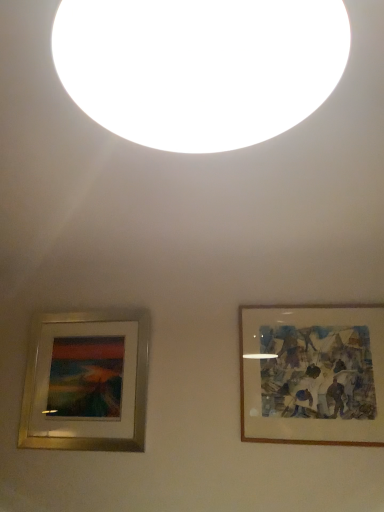
Question: From the image's perspective, is gold metallic picture frame at lower left, the second picture frame positioned from the right, located above or below wooden frame at right, which appears as the 2th picture frame when viewed from the left?

Choices:
 (A) above
 (B) below

Answer: (B)

Question: Is gold metallic picture frame at lower left, the second picture frame positioned from the right, to the left or to the right of wooden frame at right, the first picture frame in the right-to-left sequence, in the image?

Choices:
 (A) right
 (B) left

Answer: (B)

Question: Which of these objects is positioned farthest from the white matte light at upper center?

Choices:
 (A) gold metallic picture frame at lower left, which appears as the 1th picture frame when viewed from the left
 (B) wooden frame at right, the first picture frame in the right-to-left sequence

Answer: (A)

Question: Which object is positioned farthest from the white matte light at upper center?

Choices:
 (A) wooden frame at right, which appears as the 2th picture frame when viewed from the left
 (B) gold metallic picture frame at lower left, the second picture frame positioned from the right

Answer: (B)